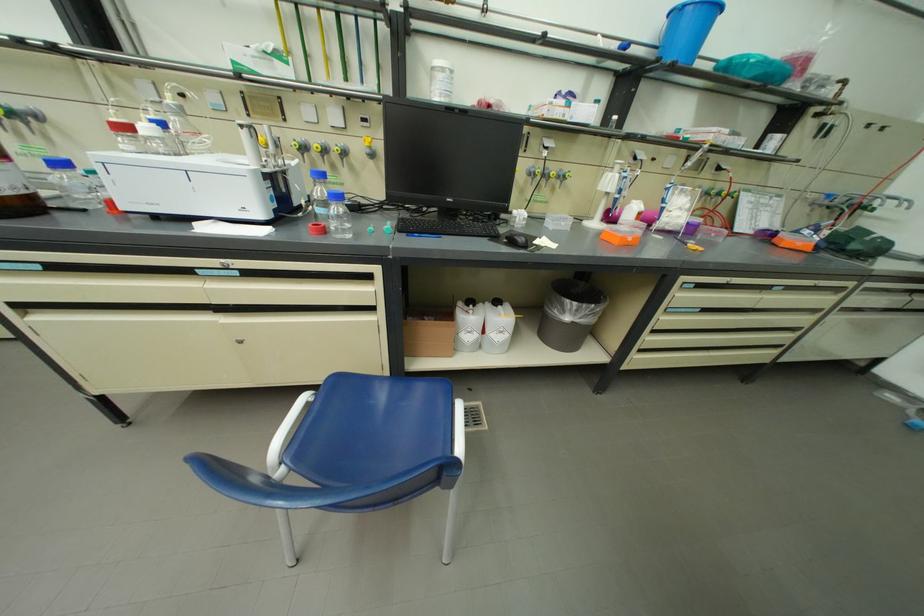
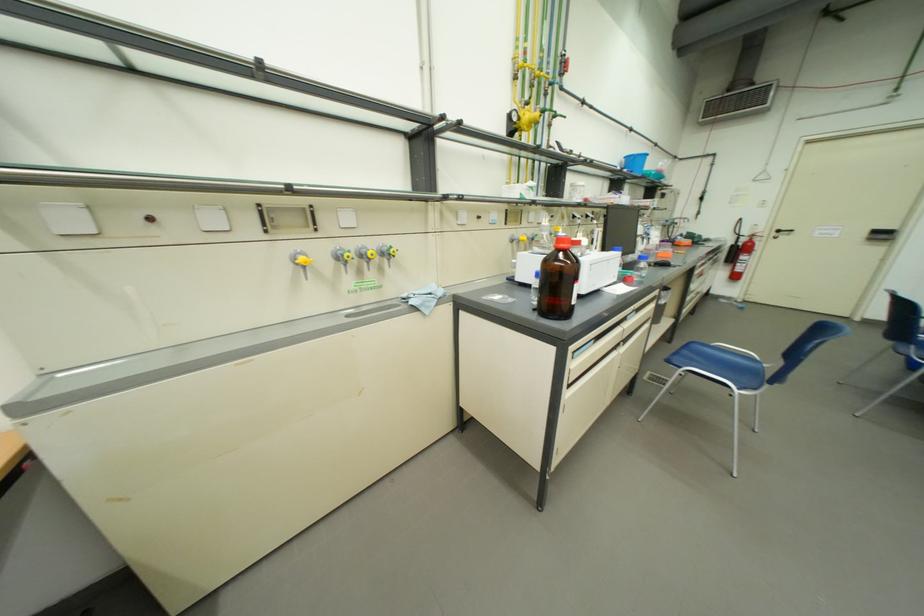
Where in the second image is the point corresponding to [609,397] from the first image?

(681, 345)